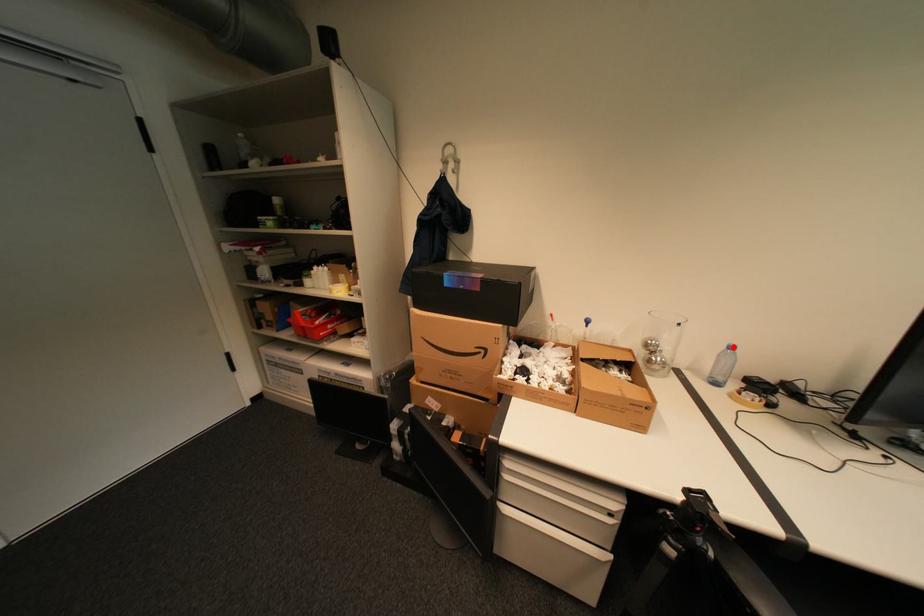
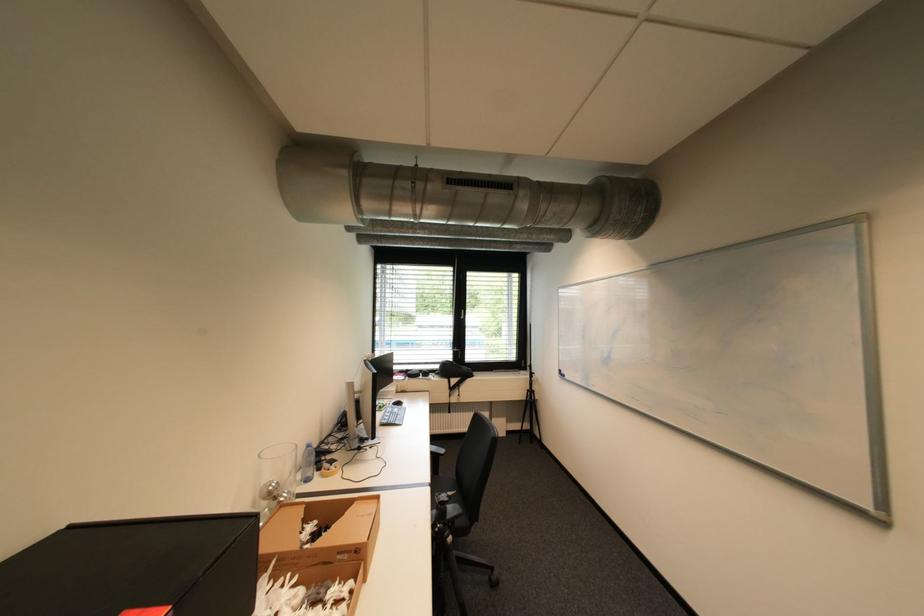
Locate, in the second image, the point that corresponds to the highlighted location in the first image.

(313, 448)